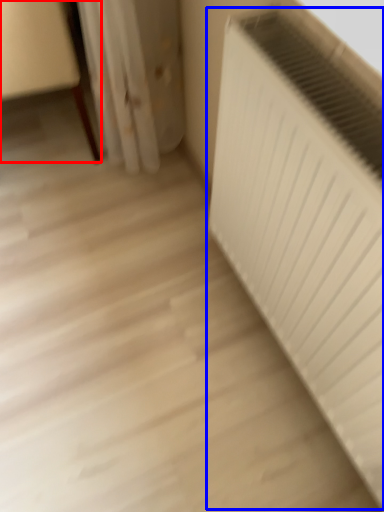
Question: Which point is further to the camera, furniture (highlighted by a red box) or radiator (highlighted by a blue box)?

Choices:
 (A) furniture
 (B) radiator

Answer: (A)